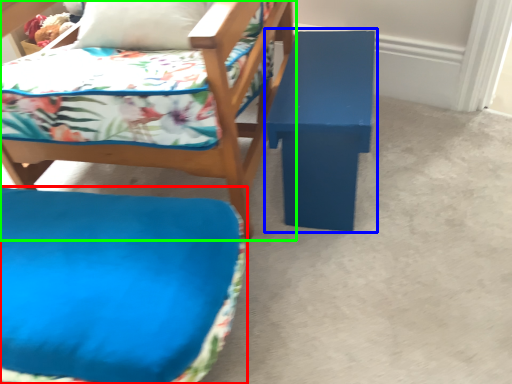
Question: Based on their relative distances, which object is farther from furniture (highlighted by a red box)? Choose from table (highlighted by a blue box) and chair (highlighted by a green box).

Choices:
 (A) table
 (B) chair

Answer: (A)